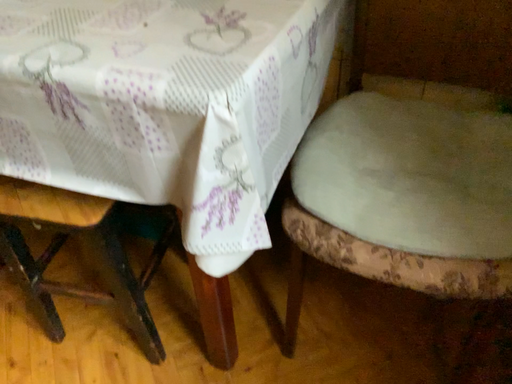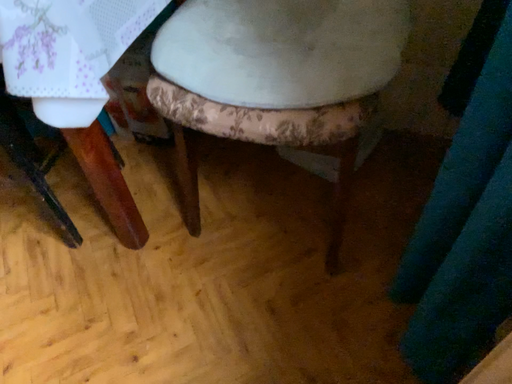
Question: Which way did the camera rotate in the video?

Choices:
 (A) rotated upward
 (B) rotated downward

Answer: (B)